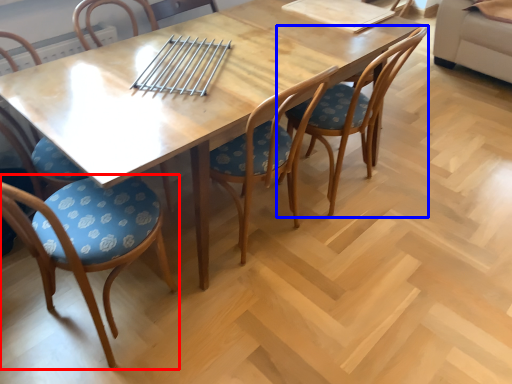
Question: Among these objects, which one is nearest to the camera, chair (highlighted by a red box) or chair (highlighted by a blue box)?

Choices:
 (A) chair
 (B) chair

Answer: (A)